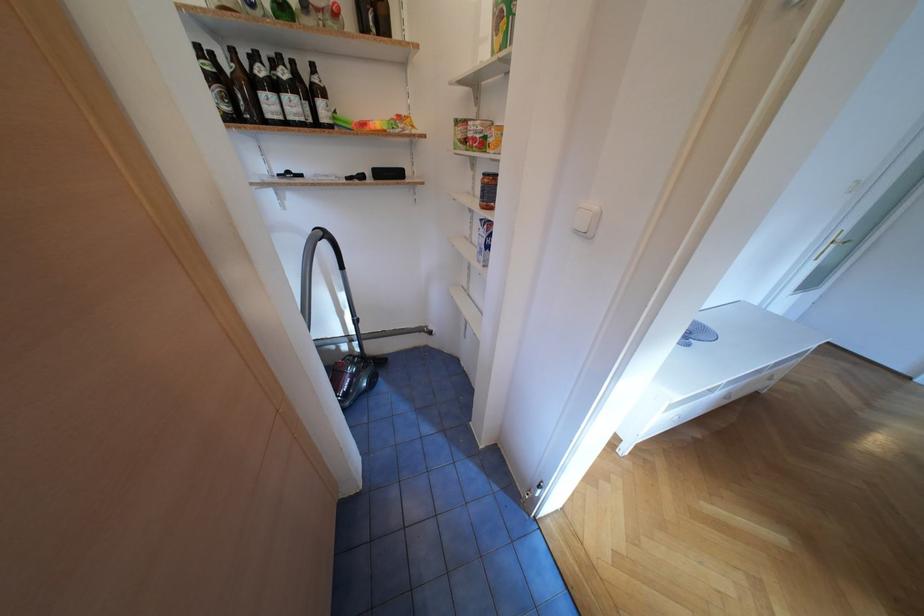
Find where to press the white light switch. Please return your answer as a coordinate pair (x, y).

(586, 220)